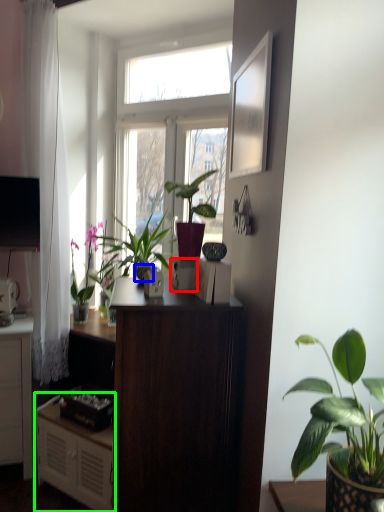
Question: Which object is the closest to the appliance (highlighted by a red box)? Choose among these: flowerpot (highlighted by a blue box) or cabinetry (highlighted by a green box).

Choices:
 (A) flowerpot
 (B) cabinetry

Answer: (A)